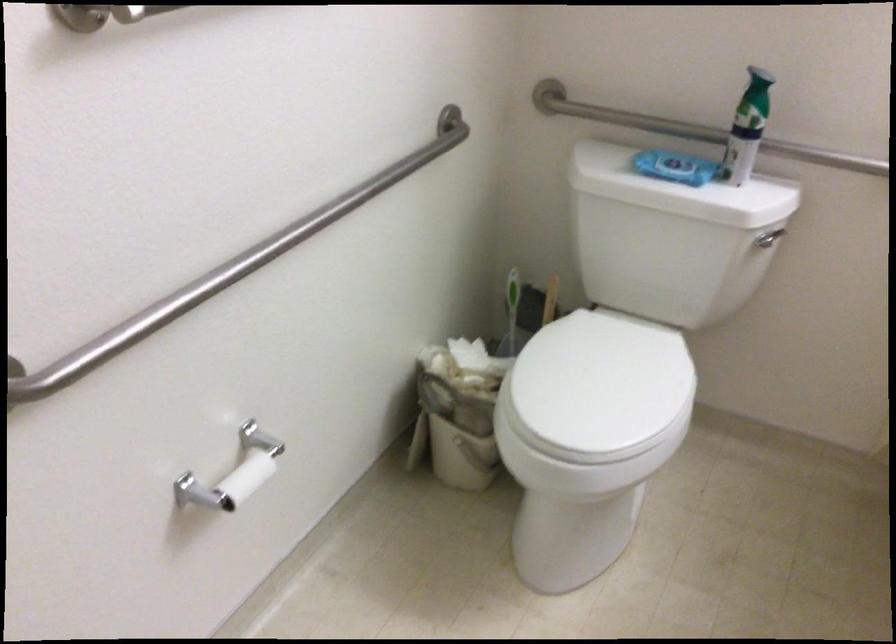
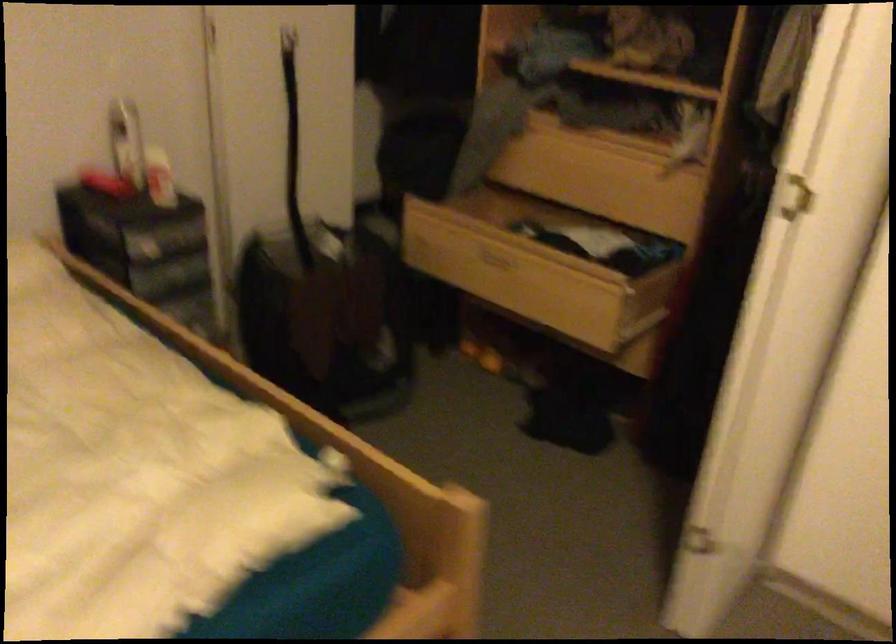
Question: I am providing you with two images of the same scene from different viewpoints. After the viewpoint changes to image2, which objects are now occluded?

Choices:
 (A) blue wipes package
 (B) middle drawer pull
 (C) open wooden drawer
 (D) white door handle

Answer: (A)